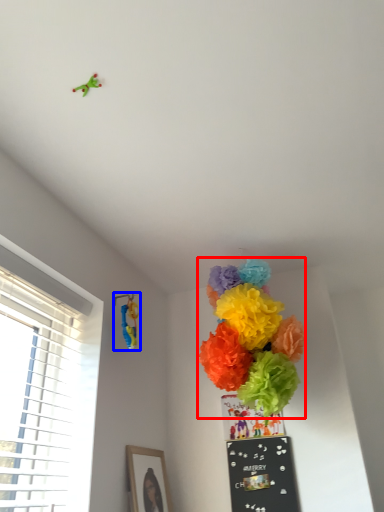
Question: Among these objects, which one is nearest to the camera, flower (highlighted by a red box) or toy (highlighted by a blue box)?

Choices:
 (A) flower
 (B) toy

Answer: (A)